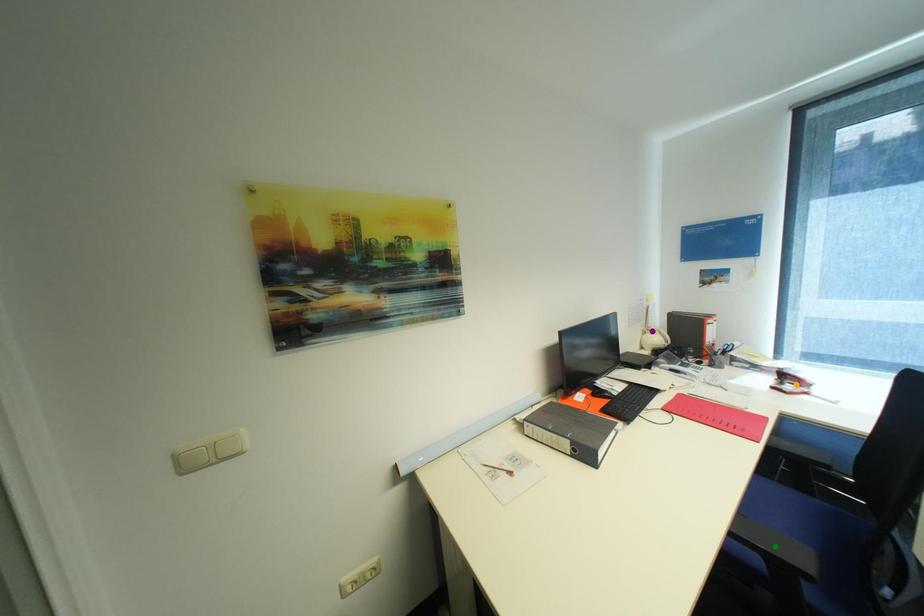
Order these from nearest to farthest:
orange point | green point | purple point

purple point < orange point < green point